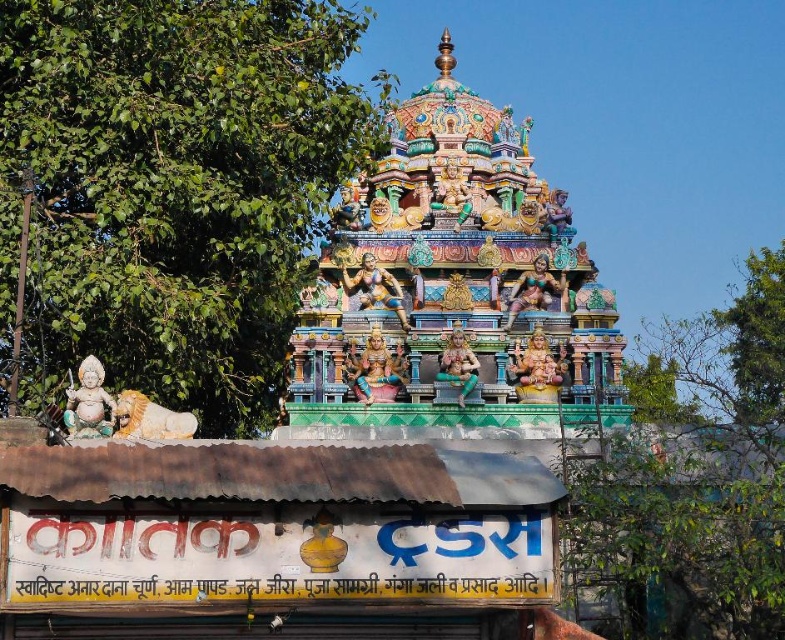
You are standing in front of the temple and want to take a photo that includes both the stone statue at lower left and the multicolored carved statue at center. Which statue should you position closer to the camera to ensure both are in focus?

You should position the stone statue at lower left closer to the camera since it is already closer to the viewer than the multicolored carved statue at center, ensuring both are in focus by maintaining their natural distances.

Based on the photo, you are standing in front of the temple and want to take a photo that includes both the stone statue at lower left and the multicolored carved statue at center. Which statue should you position closer to the left side of your camera frame?

The stone statue at lower left should be positioned closer to the left side of your camera frame because it is already located to the left of the multicolored carved statue at center.